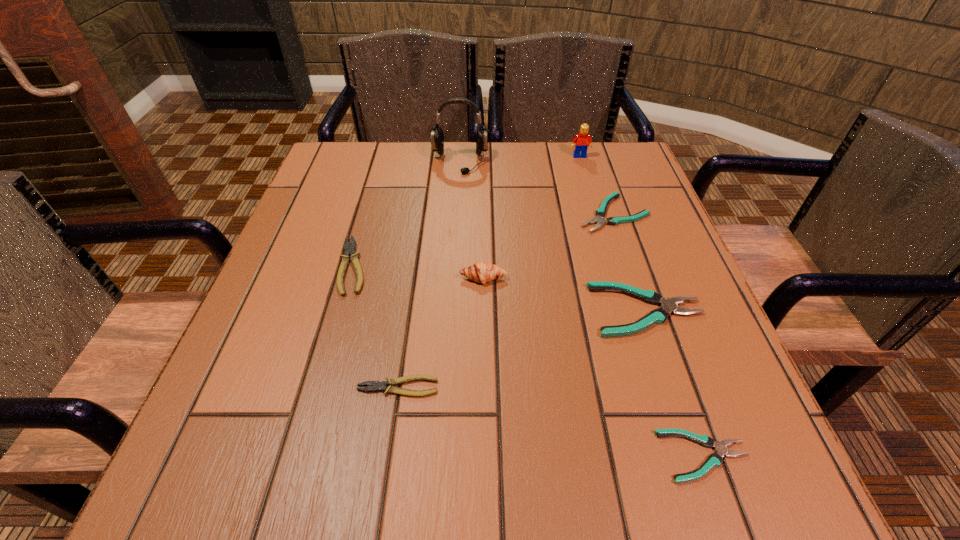
Locate an element on the screen. This screenshot has height=540, width=960. vacant region between the nearest pliers and the second farthest teal pliers is located at coordinates (676, 383).

Find the location of a particular element. The image size is (960, 540). vacant area that lies between the farthest pliers and the second tallest object is located at coordinates (596, 185).

Where is `vacant point located between the pastry and the second tallest object`? This screenshot has width=960, height=540. vacant point located between the pastry and the second tallest object is located at coordinates (532, 218).

Identify the location of free spot between the pastry and the tallest object. This screenshot has width=960, height=540. (471, 220).

The width and height of the screenshot is (960, 540). Identify the location of free space between the second farthest teal pliers and the red Lego. (613, 233).

Choose which object is the third nearest neighbor to the sixth nearest object. Please provide its 2D coordinates. Your answer should be formatted as a tuple, i.e. [(x, y)], where the tuple contains the x and y coordinates of a point satisfying the conditions above.

[(482, 272)]

Where is `object that is the second nearest to the second biggest teal pliers`? Image resolution: width=960 pixels, height=540 pixels. object that is the second nearest to the second biggest teal pliers is located at coordinates (581, 142).

Identify which pliers is the fourth closest to the sixth shortest object. Please provide its 2D coordinates. Your answer should be formatted as a tuple, i.e. [(x, y)], where the tuple contains the x and y coordinates of a point satisfying the conditions above.

[(600, 213)]

Identify which pliers is the fourth closest to the leftmost object. Please provide its 2D coordinates. Your answer should be formatted as a tuple, i.e. [(x, y)], where the tuple contains the x and y coordinates of a point satisfying the conditions above.

[(714, 460)]

Image resolution: width=960 pixels, height=540 pixels. What are the coordinates of `teal pliers that stands as the second closest to the third farthest object` in the screenshot? It's located at (714, 460).